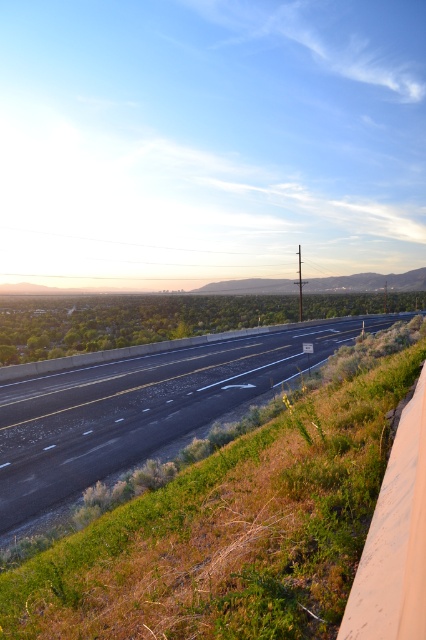
Question: Does asphalt road at center appear on the left side of green grass at lower right?

Choices:
 (A) yes
 (B) no

Answer: (A)

Question: Is asphalt road at center positioned behind green grass at lower right?

Choices:
 (A) yes
 (B) no

Answer: (A)

Question: Which of the following is the farthest from the observer?

Choices:
 (A) (393, 564)
 (B) (187, 440)

Answer: (B)

Question: Does asphalt road at center appear on the left side of green grass at lower right?

Choices:
 (A) yes
 (B) no

Answer: (A)